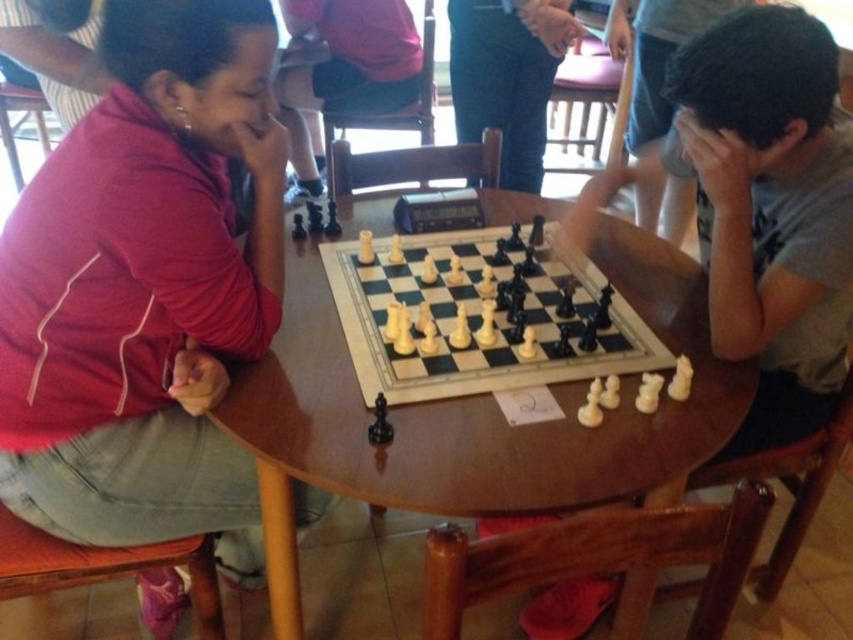
Question: Among these objects, which one is nearest to the camera?

Choices:
 (A) smooth gray shirt at center
 (B) wooden table at center
 (C) matte black chess piece at upper center

Answer: (B)

Question: Which point is closer to the camera taking this photo?

Choices:
 (A) click(416, 456)
 (B) click(340, 244)

Answer: (A)

Question: Can you confirm if matte red shirt at upper left is bigger than matte black chess piece at upper center?

Choices:
 (A) yes
 (B) no

Answer: (B)

Question: Based on their relative distances, which object is nearer to the wooden table at center?

Choices:
 (A) matte red shirt at upper left
 (B) matte black chess piece at upper center

Answer: (A)

Question: Can you confirm if wooden table at center is positioned to the left of smooth gray shirt at center?

Choices:
 (A) no
 (B) yes

Answer: (B)

Question: Does wooden table at center come in front of smooth gray shirt at center?

Choices:
 (A) no
 (B) yes

Answer: (B)